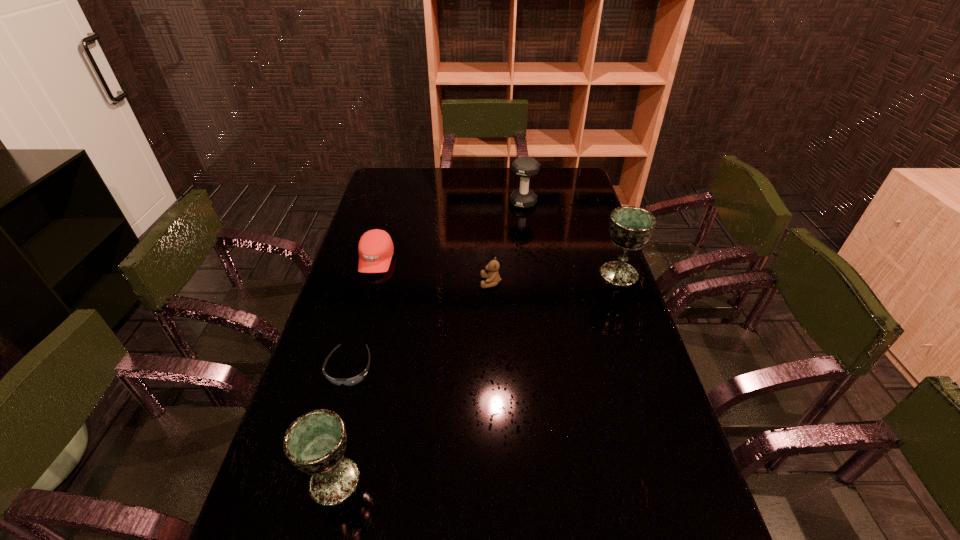
Locate an element on the screen. Image resolution: width=960 pixels, height=540 pixels. object that stands as the second closest to the fourth object from left to right is located at coordinates (630, 227).

Image resolution: width=960 pixels, height=540 pixels. What are the coordinates of `free spot that satisfies the following two spatial constraints: 1. on the front-facing side of the cap; 2. on the left side of the farther chalice` in the screenshot? It's located at (372, 274).

This screenshot has width=960, height=540. Find the location of `free space that satisfies the following two spatial constraints: 1. on the front-facing side of the nearer chalice; 2. on the right side of the cap`. free space that satisfies the following two spatial constraints: 1. on the front-facing side of the nearer chalice; 2. on the right side of the cap is located at coordinates point(314,481).

This screenshot has width=960, height=540. In order to click on free spot that satisfies the following two spatial constraints: 1. on the front-facing side of the fourth object from left to right; 2. on the lenses of the sunglasses in this screenshot , I will do `click(493, 369)`.

In order to click on vacant point that satisfies the following two spatial constraints: 1. on the front-facing side of the farther chalice; 2. on the right side of the cap in this screenshot , I will do `click(372, 274)`.

In order to click on vacant space that satisfies the following two spatial constraints: 1. on the front side of the farthest object; 2. on the front-facing side of the third object from right to left in this screenshot , I will do `click(534, 282)`.

You are a GUI agent. You are given a task and a screenshot of the screen. Output one action in this format:
    pyautogui.click(x=<x>, y=<y>)
    Task: Click on the vacant position in the image that satisfies the following two spatial constraints: 1. on the front-facing side of the cap; 2. on the left side of the nearest object
    
    Given the screenshot: What is the action you would take?
    [x=314, y=481]

Locate an element on the screen. Image resolution: width=960 pixels, height=540 pixels. free region that satisfies the following two spatial constraints: 1. on the front-facing side of the teddy bear; 2. on the lenses of the shortest object is located at coordinates (493, 369).